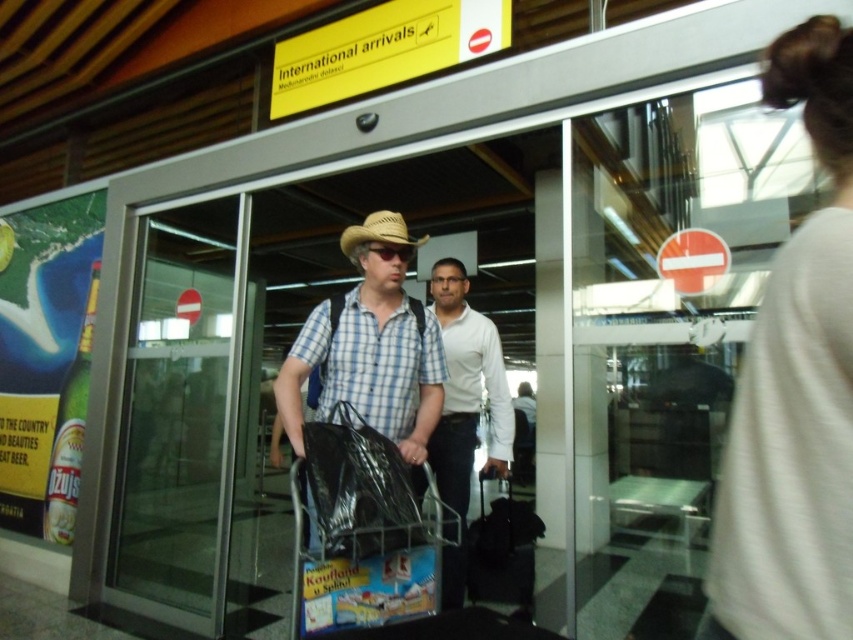
You are a security guard at the airport terminal. You notice two items in the arrivals area. The first is a plaid cotton shirt at center, and the second is a black fabric suitcase at lower right. According to airport security guidelines, all items must be scanned. Which item should you scan first if you need to start from the leftmost object?

The plaid cotton shirt at center should be scanned first because it is positioned on the left side of the black fabric suitcase at lower right, making it the leftmost object.

You are a traveler who just arrived at the airport and need to locate your luggage. You see a white cotton shirt at upper right and a black plastic bag at center. Which item is closer to the right side of the scene?

The white cotton shirt at upper right is positioned on the right side of the black plastic bag at center, so the white cotton shirt at upper right is closer to the right side of the scene.